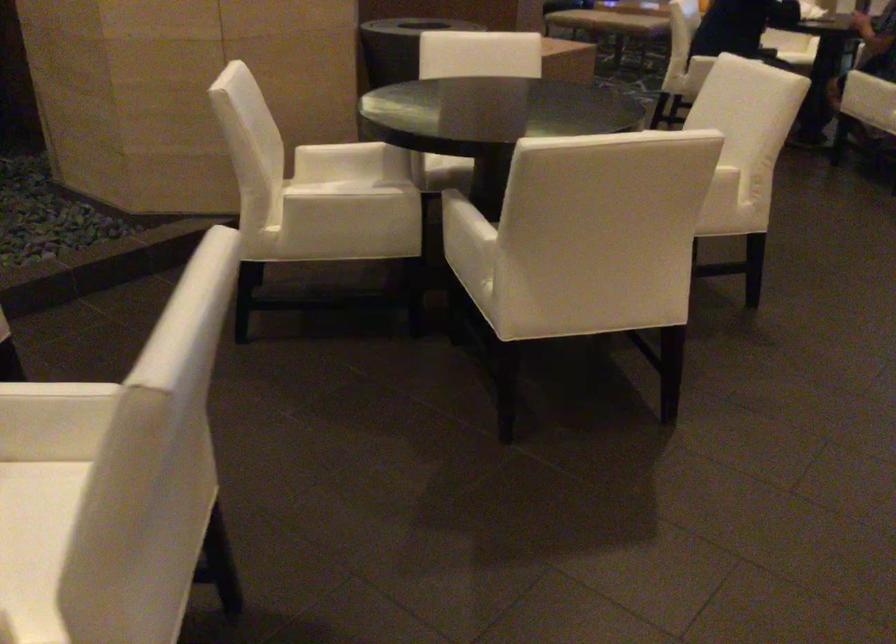
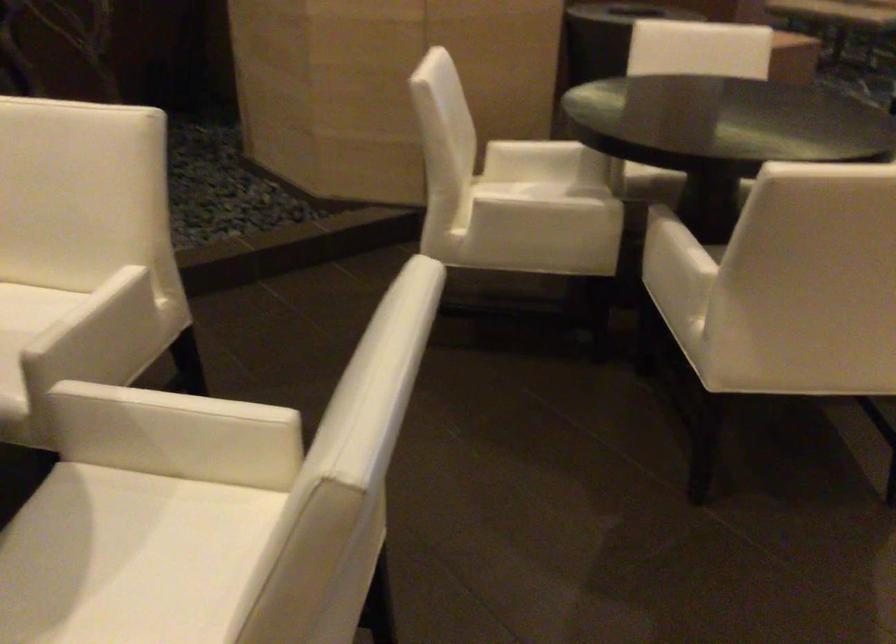
In the second image, find the point that corresponds to pixel 341 203 in the first image.

(540, 212)